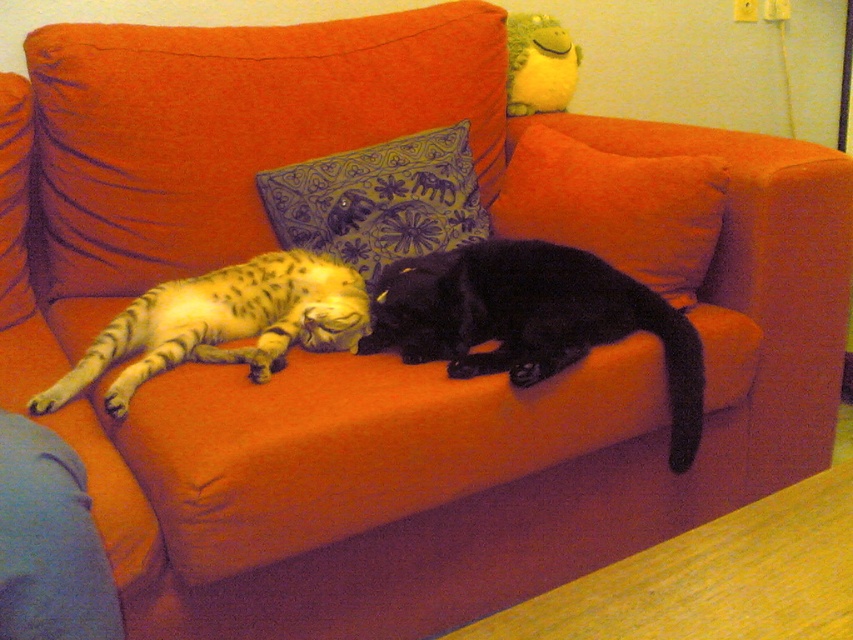
Question: Which point is closer to the camera?

Choices:
 (A) (364, 224)
 (B) (717, 230)

Answer: (B)

Question: Can you confirm if black glossy cat at center is positioned to the right of orange fabric pillow at center?

Choices:
 (A) yes
 (B) no

Answer: (B)

Question: Can you confirm if tabby fur cat at center is positioned to the left of blue embroidered pillow at center?

Choices:
 (A) yes
 (B) no

Answer: (A)

Question: Considering the real-world distances, which object is farthest from the orange fabric pillow at center?

Choices:
 (A) tabby fur cat at center
 (B) black glossy cat at center
 (C) blue embroidered pillow at center

Answer: (A)

Question: Is black glossy cat at center above blue embroidered pillow at center?

Choices:
 (A) yes
 (B) no

Answer: (B)

Question: Which is nearer to the black glossy cat at center?

Choices:
 (A) orange fabric pillow at center
 (B) blue embroidered pillow at center

Answer: (A)